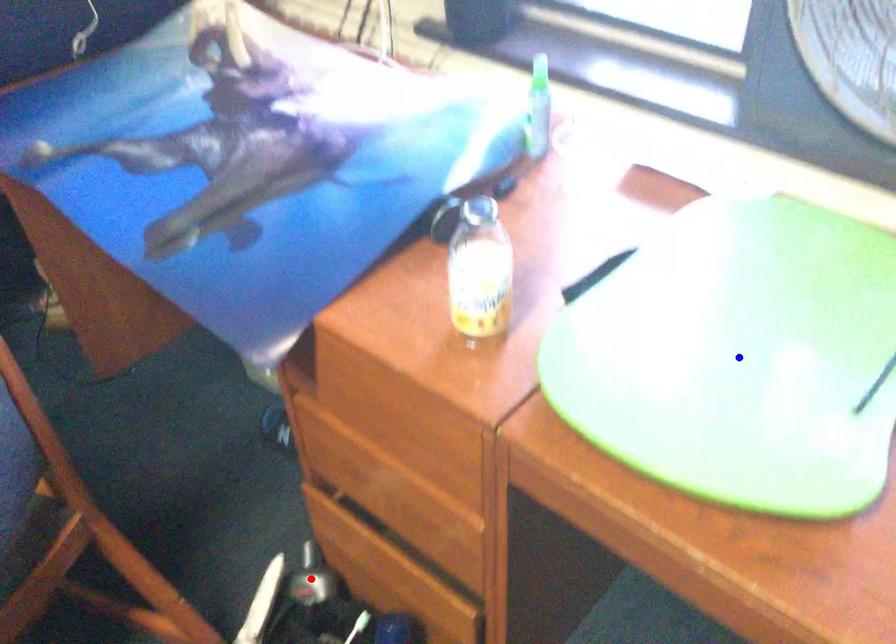
Question: Which of the two points in the image is closer to the camera?

Choices:
 (A) Blue point is closer.
 (B) Red point is closer.

Answer: (A)